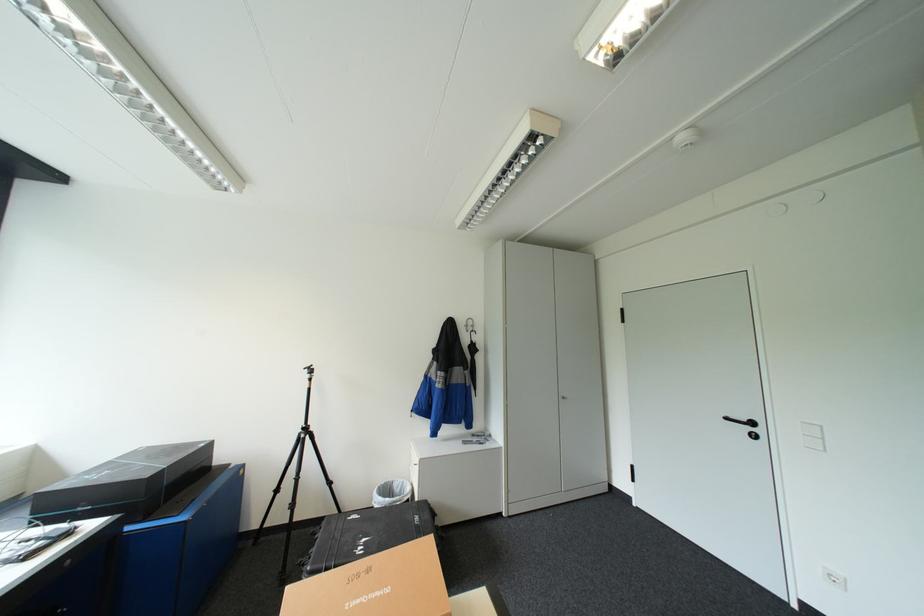
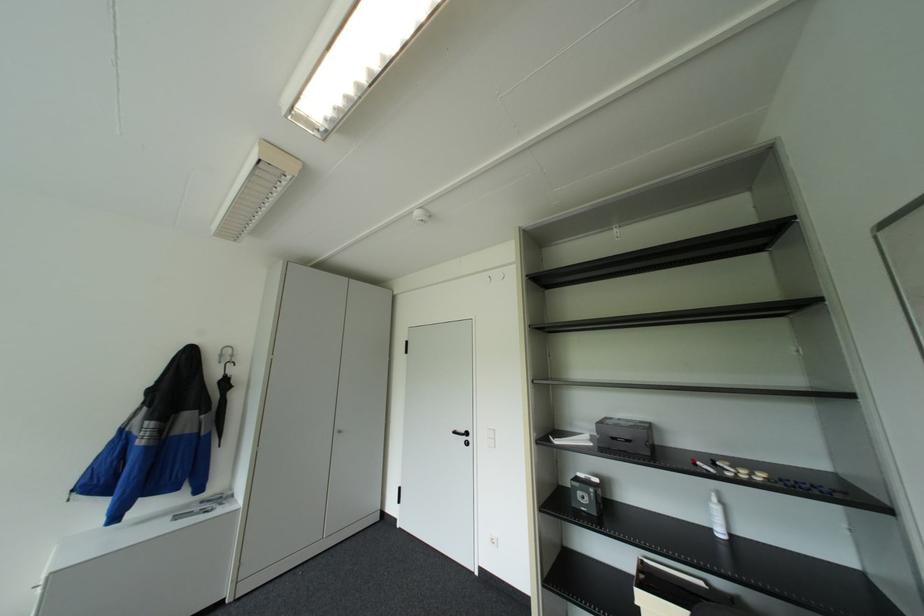
In the second image, find the point that corresponds to the point at 478,384 in the first image.

(217, 432)